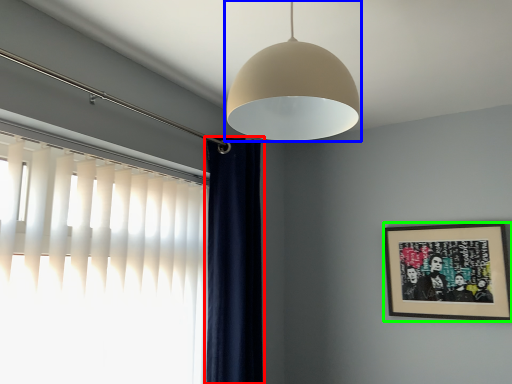
Question: Based on their relative distances, which object is farther from curtain (highlighted by a red box)? Choose from lamp (highlighted by a blue box) and picture frame (highlighted by a green box).

Choices:
 (A) lamp
 (B) picture frame

Answer: (B)